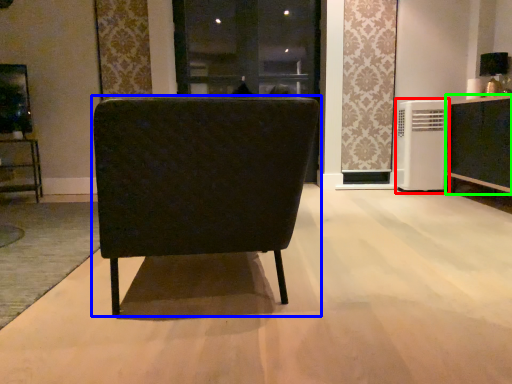
Question: Which is nearer to the air conditioner (highlighted by a red box)? chair (highlighted by a blue box) or cabinetry (highlighted by a green box).

Choices:
 (A) chair
 (B) cabinetry

Answer: (B)